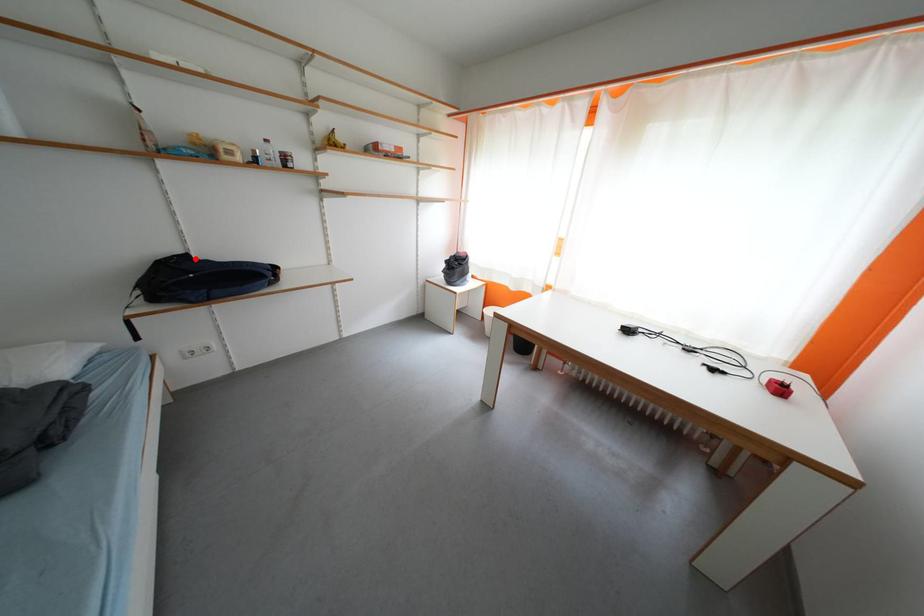
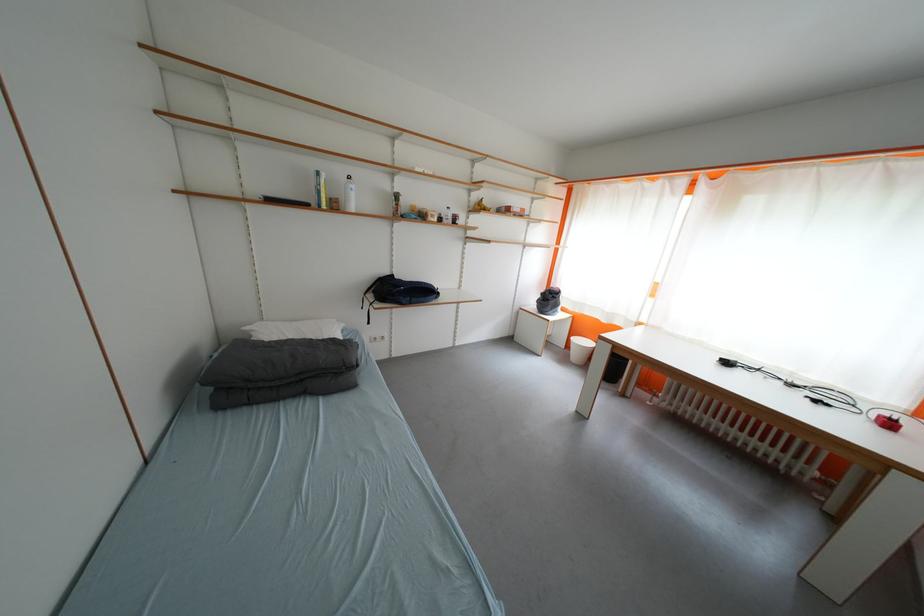
Question: A red point is marked in image1. In image2, is the corresponding 3D point closer to the camera or farther? Reply with the corresponding letter.

Choices:
 (A) The corresponding 3D point is closer.
 (B) The corresponding 3D point is farther.

Answer: (A)